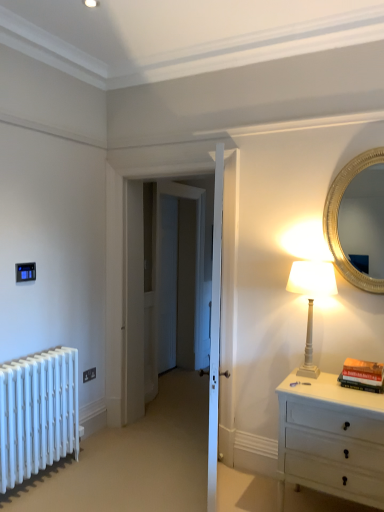
Question: Should I look upward or downward to see black plastic electrical outlet at lower left?

Choices:
 (A) up
 (B) down

Answer: (B)

Question: Are gold metallic mirror at upper right and hardcover book at right located far from each other?

Choices:
 (A) yes
 (B) no

Answer: (B)

Question: From the image's perspective, is gold metallic mirror at upper right on top of hardcover book at right?

Choices:
 (A) yes
 (B) no

Answer: (A)

Question: Can you confirm if gold metallic mirror at upper right is shorter than hardcover book at right?

Choices:
 (A) yes
 (B) no

Answer: (B)

Question: Is gold metallic mirror at upper right oriented towards hardcover book at right?

Choices:
 (A) no
 (B) yes

Answer: (A)

Question: Does gold metallic mirror at upper right touch hardcover book at right?

Choices:
 (A) yes
 (B) no

Answer: (B)

Question: From a real-world perspective, is gold metallic mirror at upper right positioned over hardcover book at right based on gravity?

Choices:
 (A) no
 (B) yes

Answer: (B)

Question: From a real-world perspective, is gold metallic mirror at upper right positioned under black plastic electrical outlet at lower left based on gravity?

Choices:
 (A) yes
 (B) no

Answer: (B)

Question: Is gold metallic mirror at upper right closer to the viewer compared to black plastic electrical outlet at lower left?

Choices:
 (A) yes
 (B) no

Answer: (A)

Question: Is gold metallic mirror at upper right at the left side of black plastic electrical outlet at lower left?

Choices:
 (A) yes
 (B) no

Answer: (B)

Question: From a real-world perspective, is gold metallic mirror at upper right over black plastic electrical outlet at lower left?

Choices:
 (A) no
 (B) yes

Answer: (B)

Question: Is gold metallic mirror at upper right positioned with its back to black plastic electrical outlet at lower left?

Choices:
 (A) yes
 (B) no

Answer: (B)

Question: Is gold metallic mirror at upper right far away from black plastic electrical outlet at lower left?

Choices:
 (A) yes
 (B) no

Answer: (A)

Question: Is black plastic electrical outlet at lower left positioned with its back to gold metallic mirror at upper right?

Choices:
 (A) no
 (B) yes

Answer: (A)